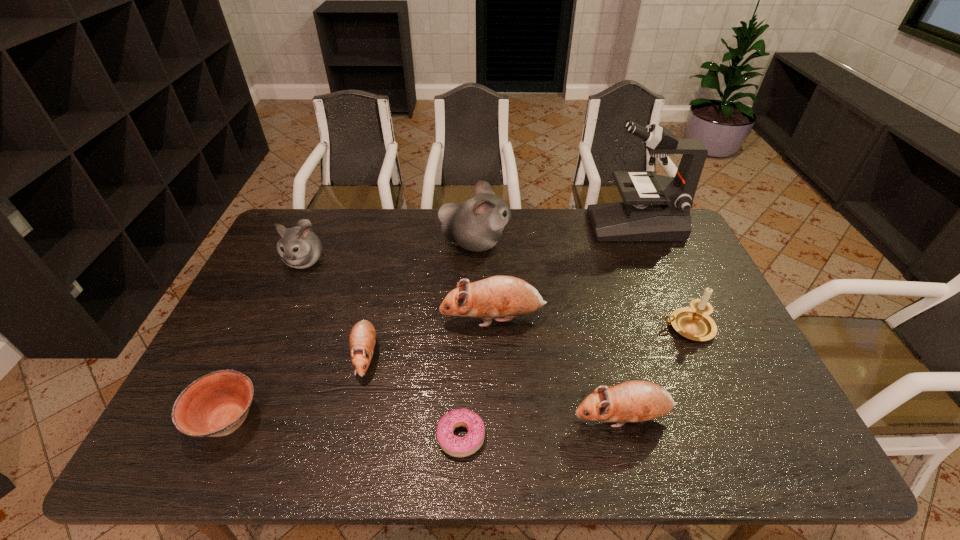
Find the location of a particular element. The image size is (960, 540). object that is at the near left corner is located at coordinates (215, 405).

Identify the location of object that is positioned at the far right corner. Image resolution: width=960 pixels, height=540 pixels. (658, 209).

Where is `blank space at the far edge of the desktop`? blank space at the far edge of the desktop is located at coordinates (527, 244).

Where is `free point at the near edge`? The image size is (960, 540). free point at the near edge is located at coordinates (465, 429).

In the image, there is a desktop. Identify the location of vacant space at the left edge. The height and width of the screenshot is (540, 960). (257, 320).

You are a GUI agent. You are given a task and a screenshot of the screen. Output one action in this format:
    pyautogui.click(x=<x>, y=<y>)
    Task: Click on the vacant space at the right edge
    Image resolution: width=960 pixels, height=540 pixels.
    Given the screenshot: What is the action you would take?
    pyautogui.click(x=743, y=373)

This screenshot has width=960, height=540. In order to click on vacant space at the near left corner of the desktop in this screenshot , I will do `click(188, 446)`.

The image size is (960, 540). Identify the location of free area in between the second shortest hamster and the bowl. (425, 420).

Locate an element on the screen. free space between the fourth hamster from right to left and the left white hamster is located at coordinates (335, 308).

Find the location of a particular element. The image size is (960, 540). vacant area between the bowl and the second hamster from left to right is located at coordinates (297, 388).